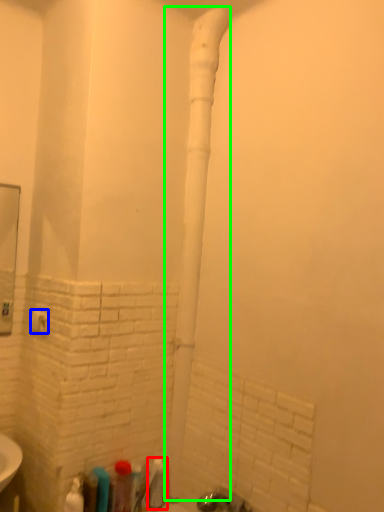
Question: Considering the real-world distances, which object is closest to toiletry (highlighted by a red box)? towel bar (highlighted by a blue box) or water pipe (highlighted by a green box).

Choices:
 (A) towel bar
 (B) water pipe

Answer: (B)